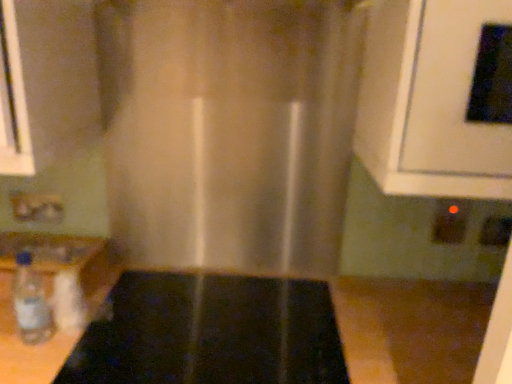
Question: Would you say black plastic electric outlet at lower right, which is the 2th electric outlet from right to left, is to the left or to the right of black glossy oven at upper right in the picture?

Choices:
 (A) right
 (B) left

Answer: (A)

Question: Looking at the image, does black plastic electric outlet at lower right, the 2th electric outlet positioned from the left, seem bigger or smaller compared to black glossy oven at upper right?

Choices:
 (A) small
 (B) big

Answer: (A)

Question: Estimate the real-world distances between objects in this image. Which object is closer to the black glass stove at center?

Choices:
 (A) matte plastic electric outlet at lower left, the first electric outlet from the left
 (B) translucent fabric curtain at center
 (C) black plastic electric outlet at lower right, which appears as the third electric outlet when viewed from the left
 (D) clear plastic bottle at lower left
 (E) black plastic electric outlet at lower right, the 2th electric outlet positioned from the left

Answer: (D)

Question: Which of these objects is positioned closest to the black glossy oven at upper right?

Choices:
 (A) translucent fabric curtain at center
 (B) matte plastic electric outlet at lower left, which is the third electric outlet in right-to-left order
 (C) black plastic electric outlet at lower right, the 2th electric outlet positioned from the left
 (D) clear plastic bottle at lower left
 (E) black plastic electric outlet at lower right, which appears as the third electric outlet when viewed from the left

Answer: (A)